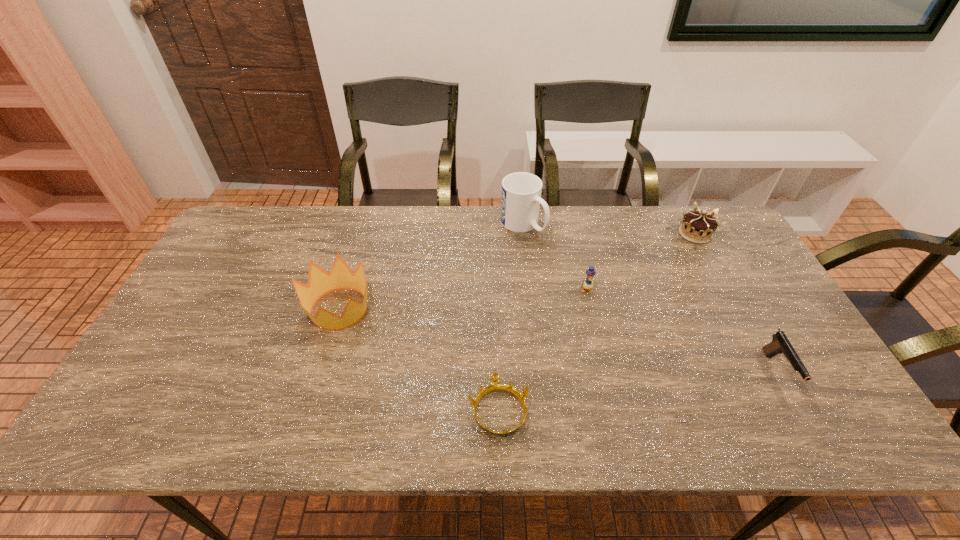
Image resolution: width=960 pixels, height=540 pixels. Find the location of `mug`. mug is located at coordinates (521, 192).

Find the location of a particular element. the leftmost object is located at coordinates point(320,282).

Find the location of a particular element. the second tallest object is located at coordinates (320, 282).

Where is `the rightmost crown`? The image size is (960, 540). the rightmost crown is located at coordinates (698, 226).

Find the location of a particular element. Image resolution: width=960 pixels, height=540 pixels. the second shortest crown is located at coordinates (698, 226).

You are a GUI agent. You are given a task and a screenshot of the screen. Output one action in this format:
    pyautogui.click(x=<x>, y=<y>)
    Task: Click on the fourth object from left to right
    The height and width of the screenshot is (540, 960).
    Given the screenshot: What is the action you would take?
    pyautogui.click(x=590, y=272)

Where is `pistol`? The width and height of the screenshot is (960, 540). pistol is located at coordinates (780, 344).

At what (x,y) coordinates should I click in order to perform the action: click on the second crown from left to right. Please return your answer as a coordinate pair (x, y). The image size is (960, 540). Looking at the image, I should click on (495, 386).

Find the location of a particular element. This screenshot has height=540, width=960. the shortest object is located at coordinates (495, 386).

Locate an element on the screen. This screenshot has width=960, height=540. blank area located on the front of the tallest object is located at coordinates (528, 274).